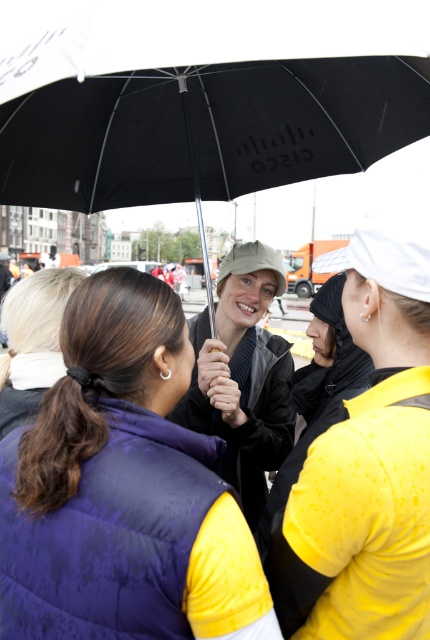
Can you confirm if black matte umbrella at center is wider than matte black umbrella at center?

Correct, the width of black matte umbrella at center exceeds that of matte black umbrella at center.

Identify the location of black matte umbrella at center. The width and height of the screenshot is (430, 640). (203, 100).

This screenshot has height=640, width=430. What do you see at coordinates (203, 100) in the screenshot? I see `black matte umbrella at center` at bounding box center [203, 100].

Identify the location of black matte umbrella at center. Image resolution: width=430 pixels, height=640 pixels. (203, 100).

Does point (149, 83) lie behind point (6, 408)?

Yes, point (149, 83) is farther from viewer.

Who is positioned more to the right, black matte umbrella at center or dark brown hair at center?

black matte umbrella at center is more to the right.

Between point (209, 170) and point (27, 387), which one is positioned in front?

Point (27, 387)

You are a GUI agent. You are given a task and a screenshot of the screen. Output one action in this format:
    pyautogui.click(x=<x>, y=<y>)
    Task: Click on the black matte umbrella at center
    This screenshot has height=640, width=430.
    Given the screenshot: What is the action you would take?
    pyautogui.click(x=203, y=100)

Can you confirm if yellow matte vest at center is positioned below dark brown hair at center?

Indeed, yellow matte vest at center is positioned under dark brown hair at center.

The width and height of the screenshot is (430, 640). I want to click on yellow matte vest at center, so click(368, 461).